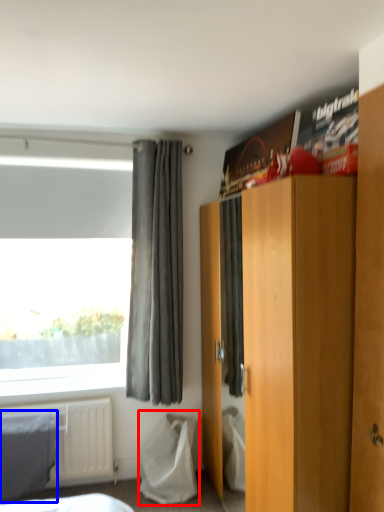
Question: Among these objects, which one is farthest to the camera, sheet (highlighted by a red box) or blanket (highlighted by a blue box)?

Choices:
 (A) sheet
 (B) blanket

Answer: (A)